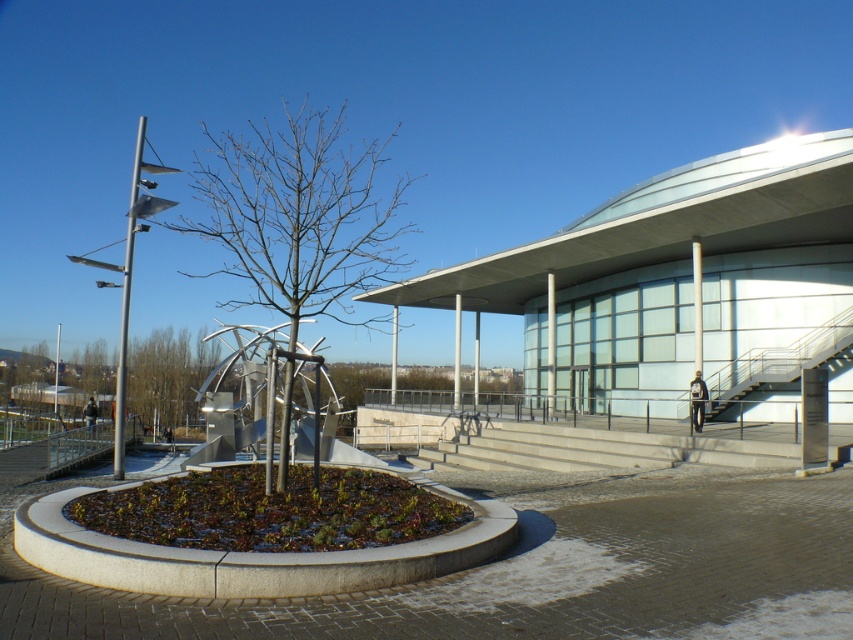
Is bare branches at center above metallic gray staircase at right?

Yes, bare branches at center is above metallic gray staircase at right.

Is bare branches at center taller than metallic gray staircase at right?

Yes, bare branches at center is taller than metallic gray staircase at right.

Is point (225, 246) closer to viewer compared to point (815, 339)?

No, (225, 246) is behind (815, 339).

At what (x,y) coordinates should I click in order to perform the action: click on bare branches at center. Please return your answer as a coordinate pair (x, y). Looking at the image, I should click on (299, 214).

Does concrete stairs at center come behind metallic gray staircase at right?

That is False.

Does concrete stairs at center appear over metallic gray staircase at right?

No.

Is point (527, 454) positioned after point (850, 388)?

No, it is in front of (850, 388).

Locate an element on the screen. This screenshot has width=853, height=640. concrete stairs at center is located at coordinates (596, 449).

Can you confirm if bare branches at center is taller than concrete stairs at center?

Yes, bare branches at center is taller than concrete stairs at center.

Find the location of a particular element. Image resolution: width=853 pixels, height=640 pixels. bare branches at center is located at coordinates (299, 214).

This screenshot has width=853, height=640. What are the coordinates of `bare branches at center` in the screenshot? It's located at (299, 214).